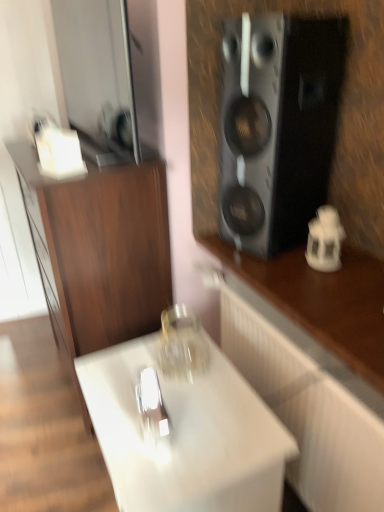
Locate an element on the screen. space that is in front of transparent glass jar at center is located at coordinates (197, 401).